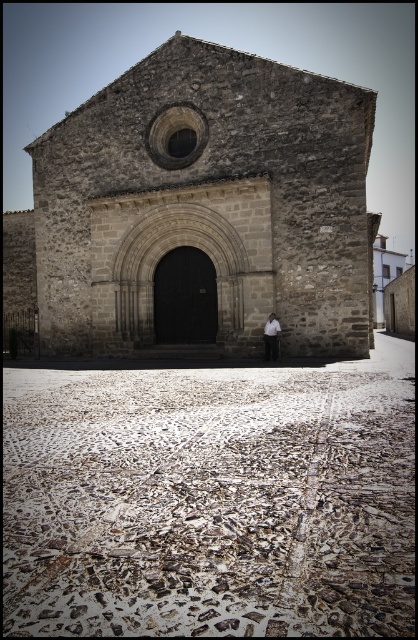
Does stone textured chapel at center appear on the right side of white cotton shirt at center?

In fact, stone textured chapel at center is to the left of white cotton shirt at center.

Can you confirm if stone textured chapel at center is bigger than white cotton shirt at center?

Correct, stone textured chapel at center is larger in size than white cotton shirt at center.

The width and height of the screenshot is (418, 640). Find the location of `stone textured chapel at center`. stone textured chapel at center is located at coordinates (206, 202).

Is white textured cobblestone at lower center shorter than white cotton shirt at center?

Indeed, white textured cobblestone at lower center has a lesser height compared to white cotton shirt at center.

Based on the photo, can you confirm if white textured cobblestone at lower center is positioned above white cotton shirt at center?

Incorrect, white textured cobblestone at lower center is not positioned above white cotton shirt at center.

Identify the location of white textured cobblestone at lower center. The image size is (418, 640). (209, 502).

Does white textured cobblestone at lower center appear under stone textured chapel at center?

Correct, white textured cobblestone at lower center is located below stone textured chapel at center.

Is white textured cobblestone at lower center shorter than stone textured chapel at center?

Yes.

What do you see at coordinates (209, 502) in the screenshot? This screenshot has height=640, width=418. I see `white textured cobblestone at lower center` at bounding box center [209, 502].

Locate an element on the screen. white textured cobblestone at lower center is located at coordinates (209, 502).